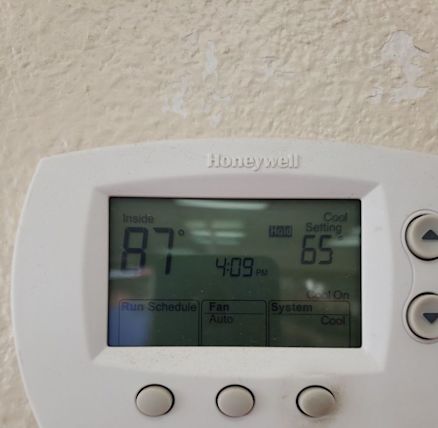
Identify the location of light reflection on led panel. This screenshot has width=438, height=428. (230, 234).